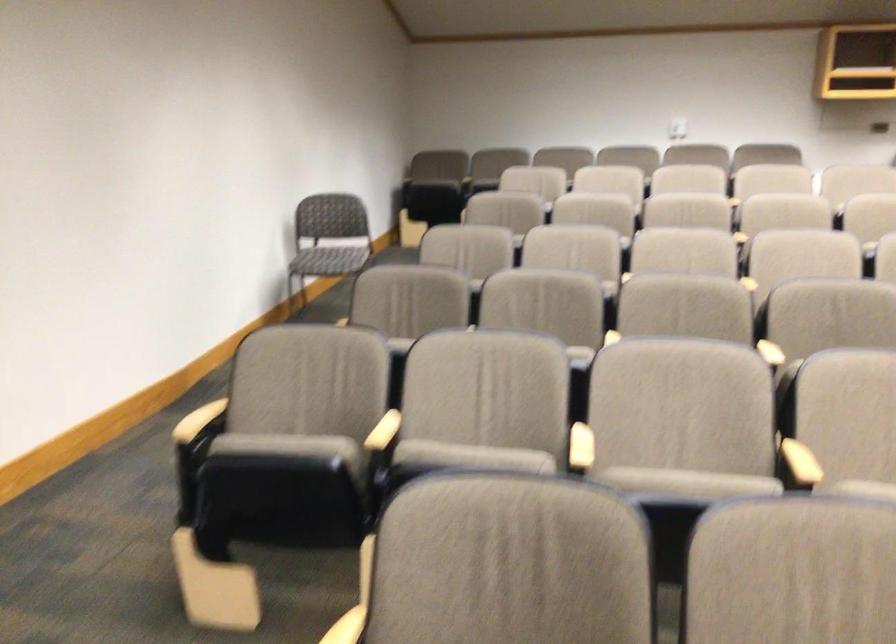
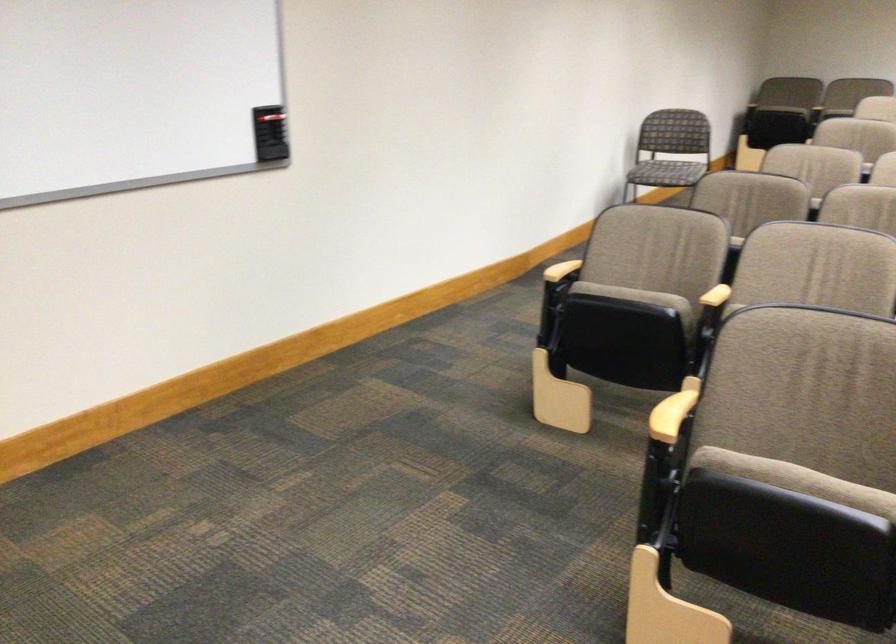
In the second image, find the point that corresponds to the point at 283,462 in the first image.

(633, 295)